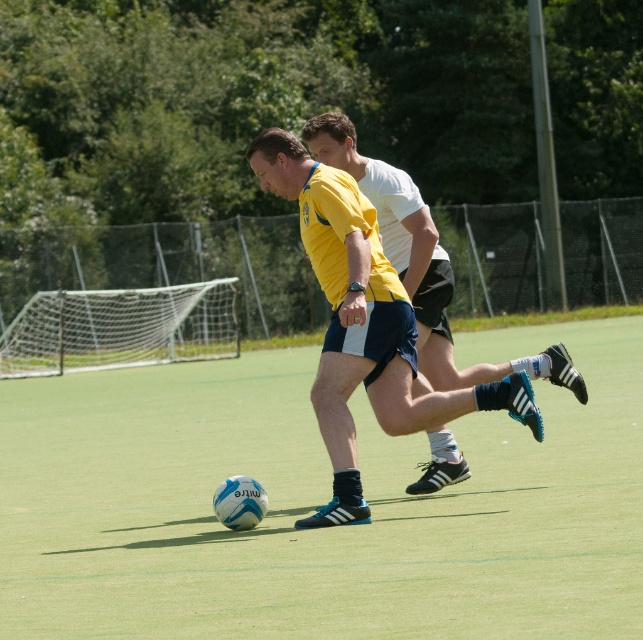
This screenshot has height=640, width=643. What do you see at coordinates (320, 502) in the screenshot?
I see `green artificial turf at center` at bounding box center [320, 502].

Which is more to the left, green artificial turf at center or matte blue shorts at center?

green artificial turf at center is more to the left.

Who is more forward, (213, 397) or (386, 204)?

Positioned in front is point (386, 204).

Image resolution: width=643 pixels, height=640 pixels. Find the location of `green artificial turf at center`. green artificial turf at center is located at coordinates (320, 502).